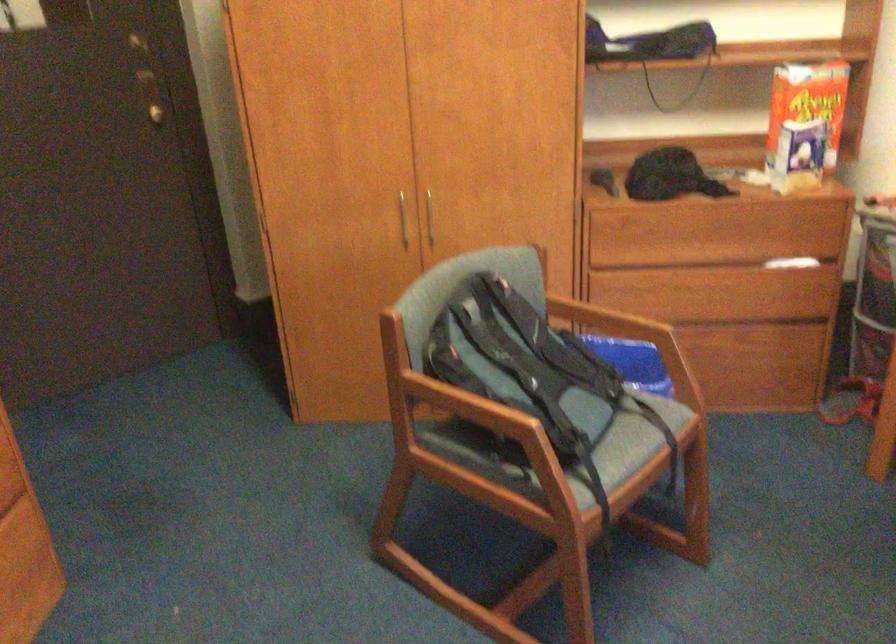
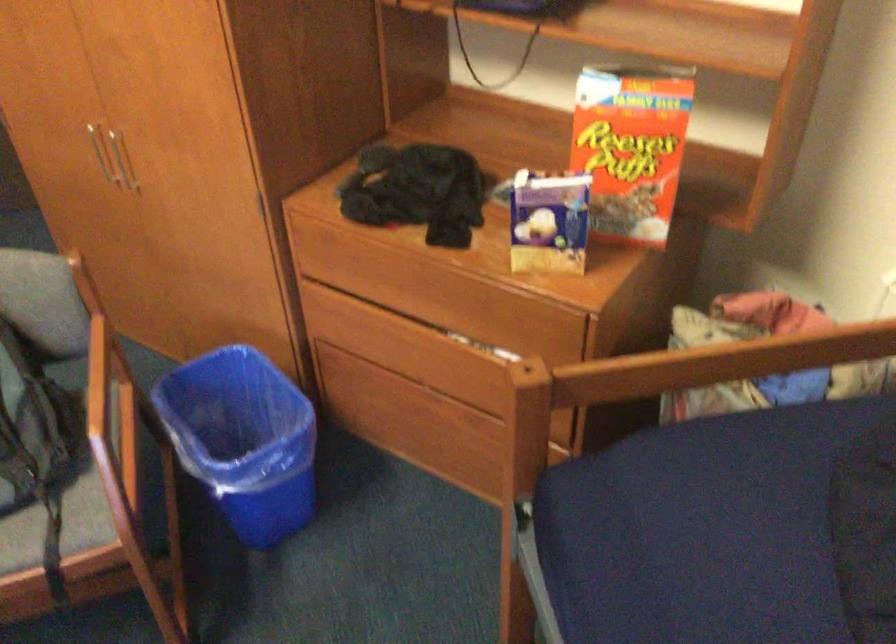
In the second image, find the point that corresponds to [426,210] in the first image.

(122, 160)